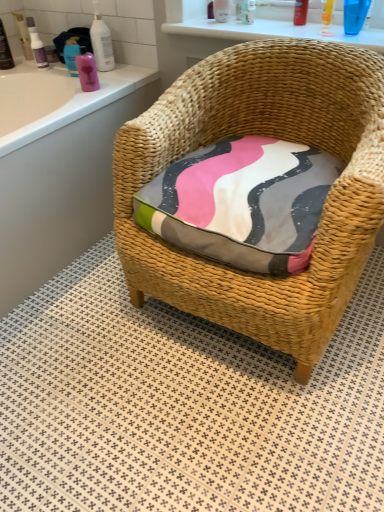
Where is `vacant space that's between translucent plastic bottle at upper left, the 3th toiletry positioned from the left, and matte black bottle at upper left, which is the tenth toiletry from right to left`? This screenshot has width=384, height=512. vacant space that's between translucent plastic bottle at upper left, the 3th toiletry positioned from the left, and matte black bottle at upper left, which is the tenth toiletry from right to left is located at coordinates (24, 71).